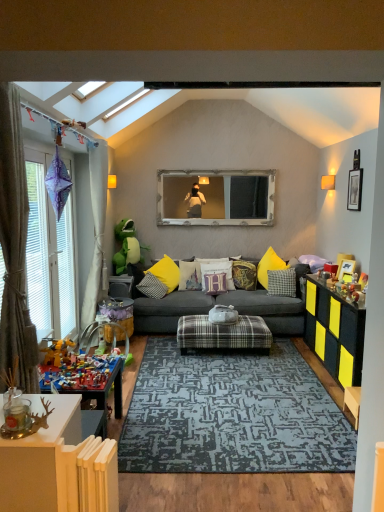
Identify the location of free point above plush yellow pillow at center, the 3th pillow from the left (from a real-world perspective). (224, 270).